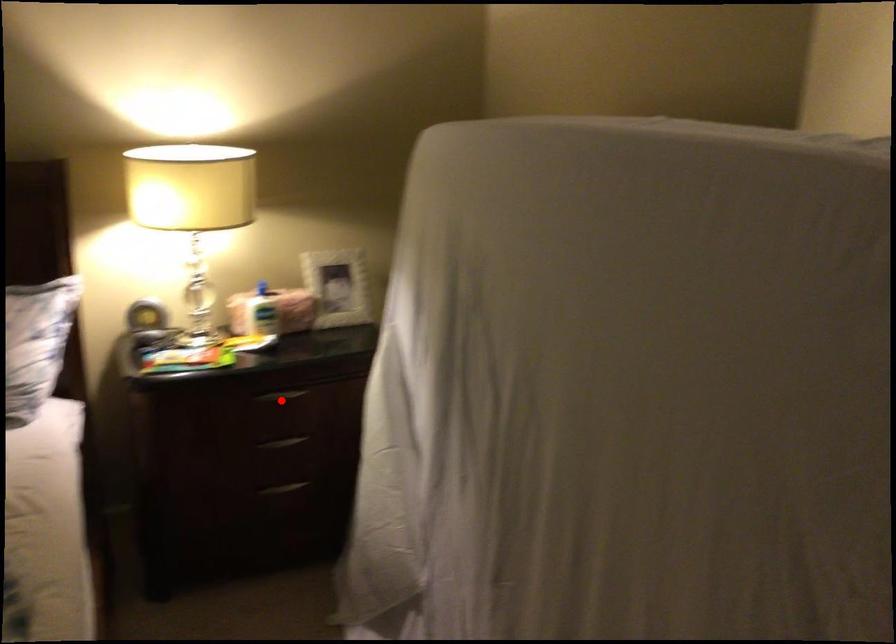
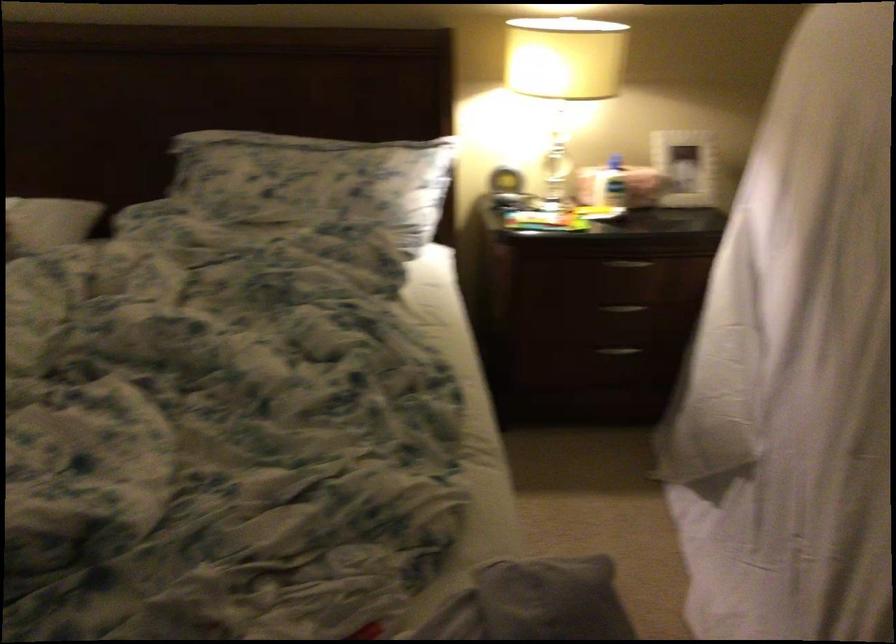
In the second image, find the point that corresponds to the highlighted location in the first image.

(627, 263)